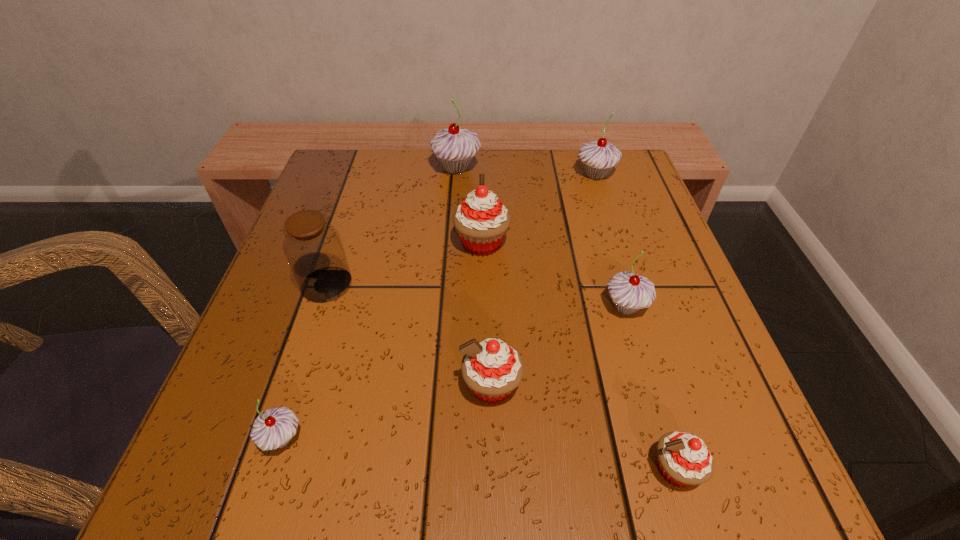
In order to click on the nearest gray cupcake in this screenshot , I will do `click(274, 428)`.

Where is `the smallest gray cupcake`? the smallest gray cupcake is located at coordinates (274, 428).

This screenshot has width=960, height=540. I want to click on the nearest pink cupcake, so click(684, 459).

Find the location of `the rightmost pink cupcake`. the rightmost pink cupcake is located at coordinates (684, 459).

Find the location of a particular element. The image size is (960, 540). vacant space located 0.050m on the left of the second gray cupcake from left to right is located at coordinates (410, 168).

Image resolution: width=960 pixels, height=540 pixels. Identify the location of vacant space situated 0.210m on the front of the second biggest gray cupcake. (619, 248).

You are a GUI agent. You are given a task and a screenshot of the screen. Output one action in this format:
    pyautogui.click(x=<x>, y=<y>)
    Task: Click on the blank area located 0.210m on the left of the biggest pink cupcake
    The height and width of the screenshot is (540, 960).
    Given the screenshot: What is the action you would take?
    pyautogui.click(x=348, y=244)

At what (x,y) coordinates should I click in order to perform the action: click on free spot located 0.110m on the back of the brown jar. Please return your answer as a coordinate pair (x, y). This screenshot has width=960, height=540. Looking at the image, I should click on (345, 229).

Image resolution: width=960 pixels, height=540 pixels. I want to click on vacant space located on the back of the fourth farthest cupcake, so tap(592, 195).

Locate an element on the screen. The width and height of the screenshot is (960, 540). vacant space located on the back of the third nearest object is located at coordinates (489, 270).